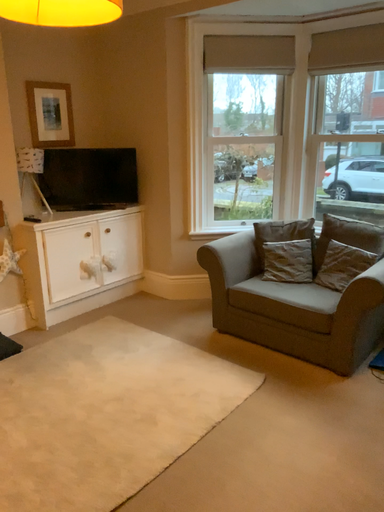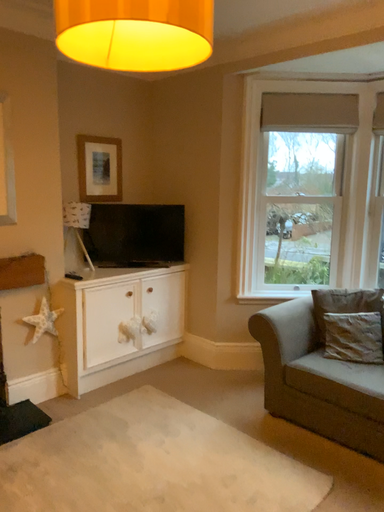
Question: How did the camera likely rotate when shooting the video?

Choices:
 (A) rotated upward
 (B) rotated downward

Answer: (A)